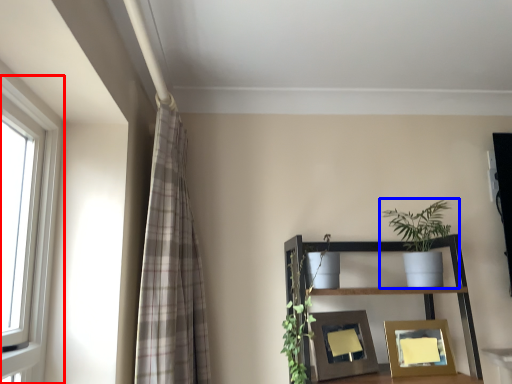
Question: Which of the following is the farthest to the observer, window (highlighted by a red box) or houseplant (highlighted by a blue box)?

Choices:
 (A) window
 (B) houseplant

Answer: (B)